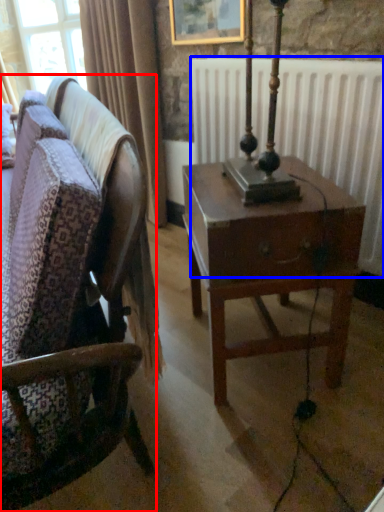
Question: Which of the following is the farthest to the observer, chair (highlighted by a red box) or radiator (highlighted by a blue box)?

Choices:
 (A) chair
 (B) radiator

Answer: (B)